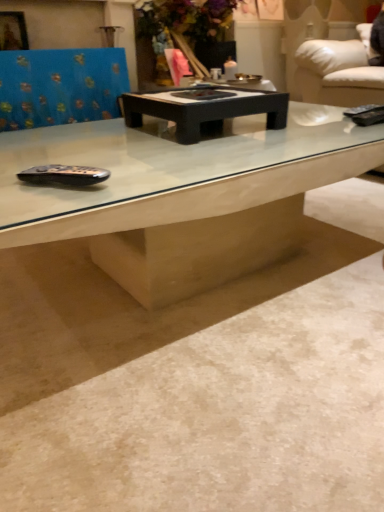
In order to click on empty space that is ontop of white marble concrete at center (from a real-world perspective) in this screenshot , I will do `click(265, 283)`.